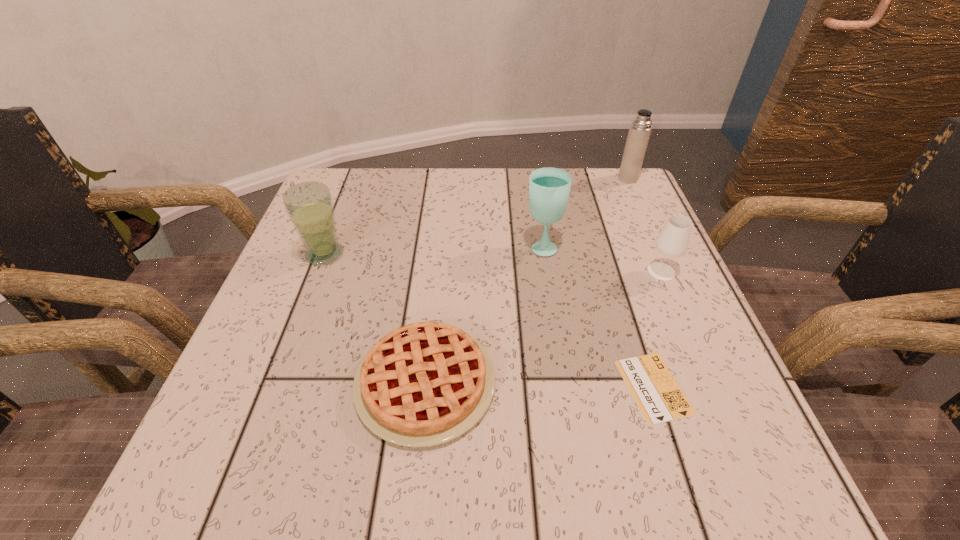
You are a GUI agent. You are given a task and a screenshot of the screen. Output one action in this format:
    pyautogui.click(x=<x>, y=<y>)
    Task: Click on the thermos bottle
    Image resolution: width=960 pixels, height=540 pixels.
    Given the screenshot: What is the action you would take?
    pyautogui.click(x=639, y=132)

Identify the location of the second glass from left to right. (549, 188).

The image size is (960, 540). Identify the location of the leftmost object. (309, 205).

Identify the location of the shortest glass. (672, 242).

You are a GUI agent. You are given a task and a screenshot of the screen. Output one action in this format:
    pyautogui.click(x=<x>, y=<y>)
    Task: Click on the third shortest object
    The width and height of the screenshot is (960, 540).
    Given the screenshot: What is the action you would take?
    (x=672, y=242)

In order to click on the fifth tallest object in this screenshot , I will do `click(423, 384)`.

What are the coordinates of `pie` in the screenshot? It's located at (423, 384).

Where is `identity card`? identity card is located at coordinates (656, 393).

At what (x,y) coordinates should I click in order to perform the action: click on the shortest object. Please return your answer as a coordinate pair (x, y). This screenshot has height=540, width=960. Looking at the image, I should click on (656, 393).

At what (x,y) coordinates should I click in order to perform the action: click on vacant space situated on the front of the thermos bottle. Please return your answer as a coordinate pair (x, y). Image resolution: width=960 pixels, height=540 pixels. Looking at the image, I should click on (682, 299).